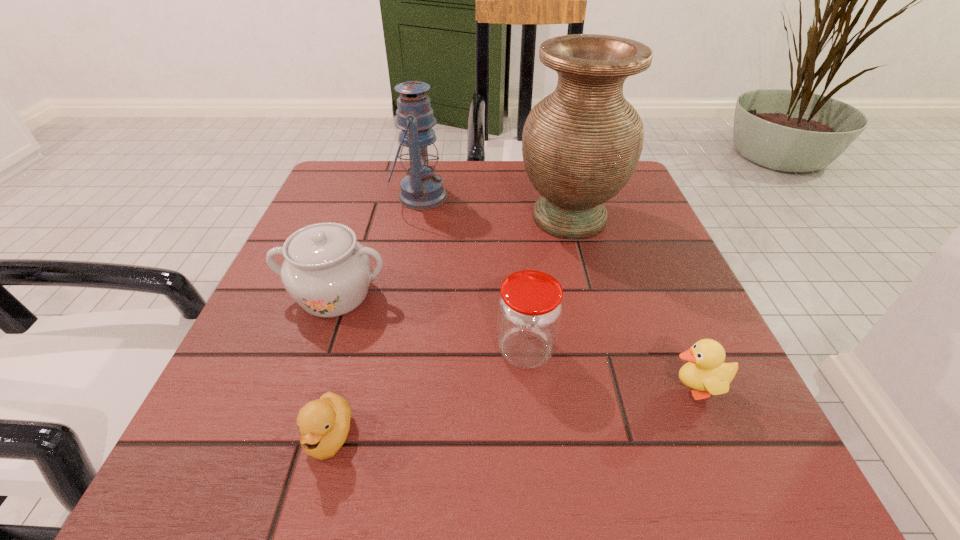
Identify the location of vase located in the right edge section of the desktop. This screenshot has height=540, width=960. (581, 144).

The width and height of the screenshot is (960, 540). I want to click on duckling positioned at the right edge, so click(x=705, y=371).

Find the location of a particular element. This screenshot has height=540, width=960. object located in the near left corner section of the desktop is located at coordinates (324, 423).

What are the coordinates of `object that is positioned at the far right corner` in the screenshot? It's located at (581, 144).

The height and width of the screenshot is (540, 960). What are the coordinates of `vacant area at the far edge` in the screenshot? It's located at (462, 179).

Locate an element on the screen. The image size is (960, 540). vacant position at the near edge of the desktop is located at coordinates (315, 460).

I want to click on blank space at the left edge, so click(x=308, y=328).

What are the coordinates of `free space at the right edge` in the screenshot? It's located at (628, 269).

This screenshot has height=540, width=960. Identify the location of free space at the far left corner. (381, 196).

In the image, there is a desktop. In order to click on vacant space at the near left corner in this screenshot , I will do `click(280, 457)`.